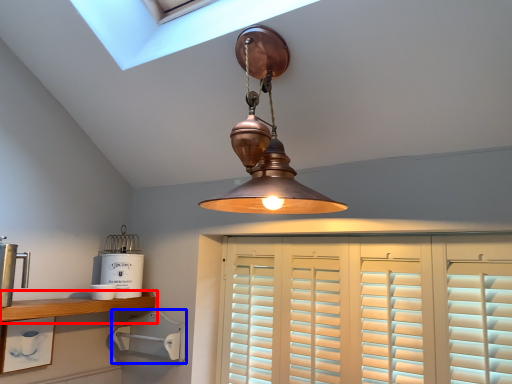
Question: Which of the following is the closest to the observer, shelf (highlighted by a red box) or appliance (highlighted by a blue box)?

Choices:
 (A) shelf
 (B) appliance

Answer: (A)